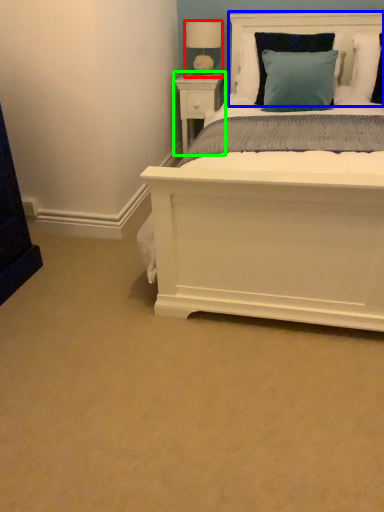
Question: Estimate the real-world distances between objects in this image. Which object is closer to table lamp (highlighted by a red box), headboard (highlighted by a blue box) or nightstand (highlighted by a green box)?

Choices:
 (A) headboard
 (B) nightstand

Answer: (B)